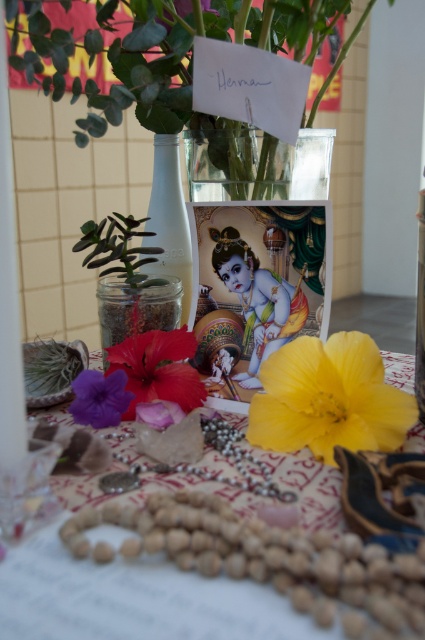
Question: Among these points, which one is nearest to the camera?

Choices:
 (A) (176, 404)
 (B) (158, 321)
 (C) (164, 227)

Answer: (A)

Question: Which point is farther from the camera taking this photo?

Choices:
 (A) (164, 406)
 (B) (241, 621)

Answer: (A)

Question: Is yellow matte flower at center wider than purple matte flower at lower left?

Choices:
 (A) no
 (B) yes

Answer: (B)

Question: Estimate the real-world distances between objects in this image. Which object is farther from the green leafy plant at upper left?

Choices:
 (A) smooth golden idol at center
 (B) pink matte flower at center
 (C) textured fabric tablecloth at center
 (D) white matte bottle at center

Answer: (C)

Question: Can you confirm if textured fabric tablecloth at center is wider than purple matte flower at lower left?

Choices:
 (A) no
 (B) yes

Answer: (B)

Question: Does white matte bottle at center appear on the right side of purple matte flower at lower left?

Choices:
 (A) yes
 (B) no

Answer: (A)